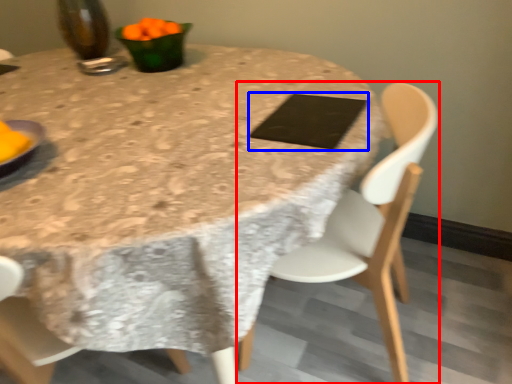
Question: Which object is closer to the camera taking this photo, chair (highlighted by a red box) or pad (highlighted by a blue box)?

Choices:
 (A) chair
 (B) pad

Answer: (A)